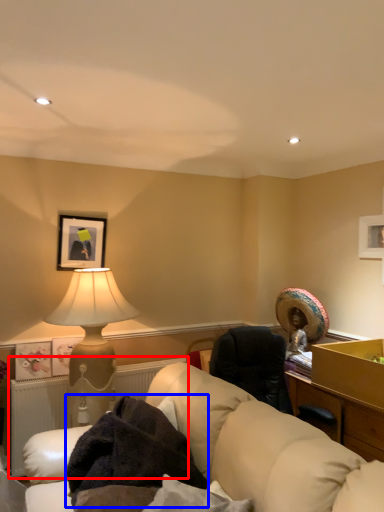
Question: Which object is closer to the camera taking this photo, radiator (highlighted by a red box) or blanket (highlighted by a blue box)?

Choices:
 (A) radiator
 (B) blanket

Answer: (B)